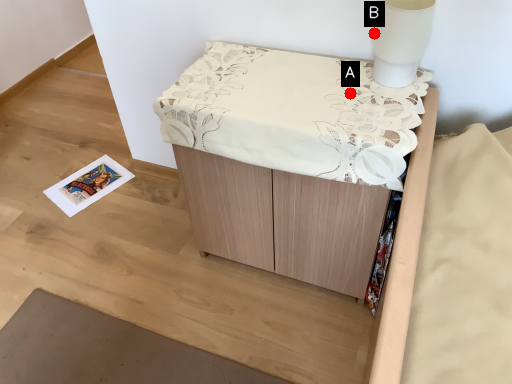
Question: Two points are circled on the image, labeled by A and B beside each circle. Among these points, which one is farthest from the camera?

Choices:
 (A) A is further
 (B) B is further

Answer: (B)